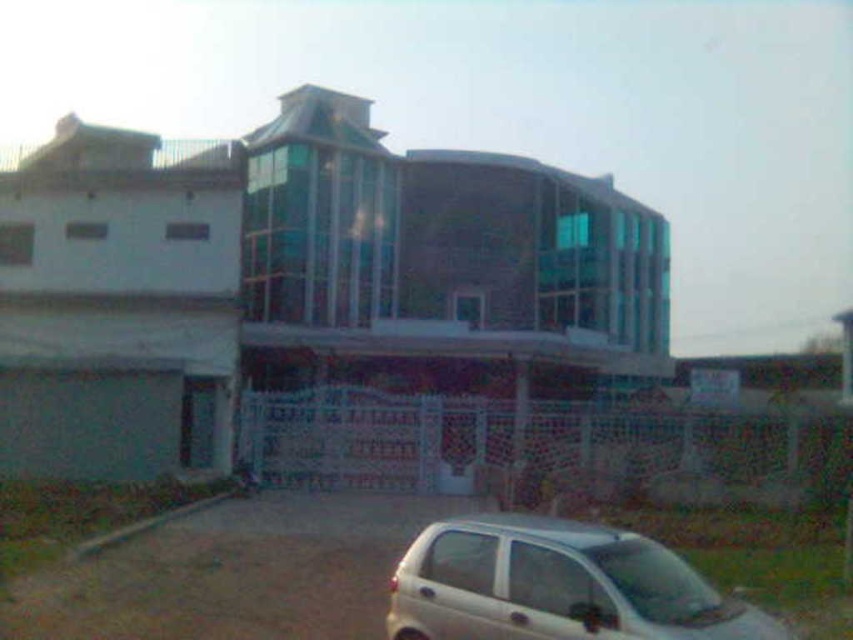
Between brown gravel at lower center and white matte car at lower right, which one is positioned lower?

brown gravel at lower center is lower down.

Does point (245, 579) come closer to viewer compared to point (432, 624)?

That is False.

Locate an element on the screen. brown gravel at lower center is located at coordinates (234, 573).